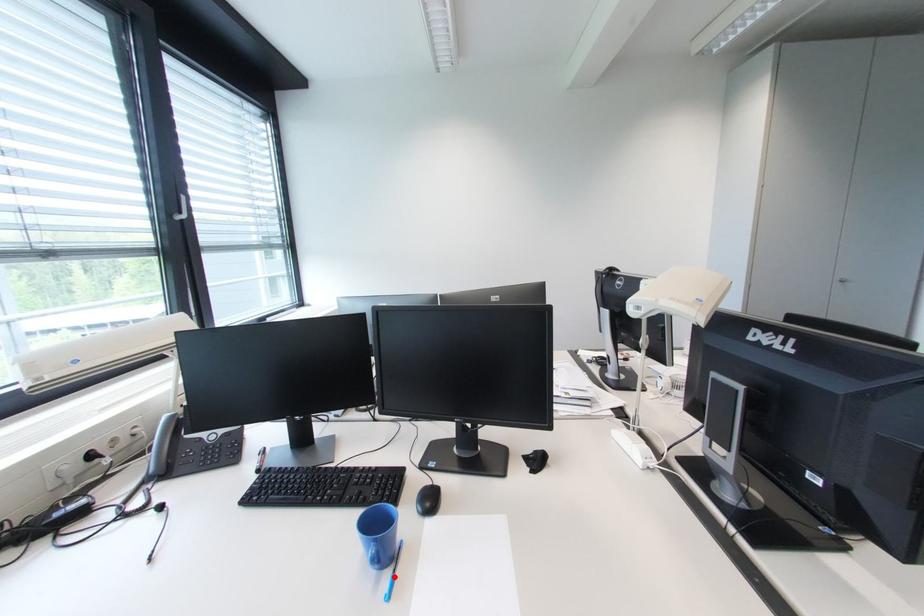
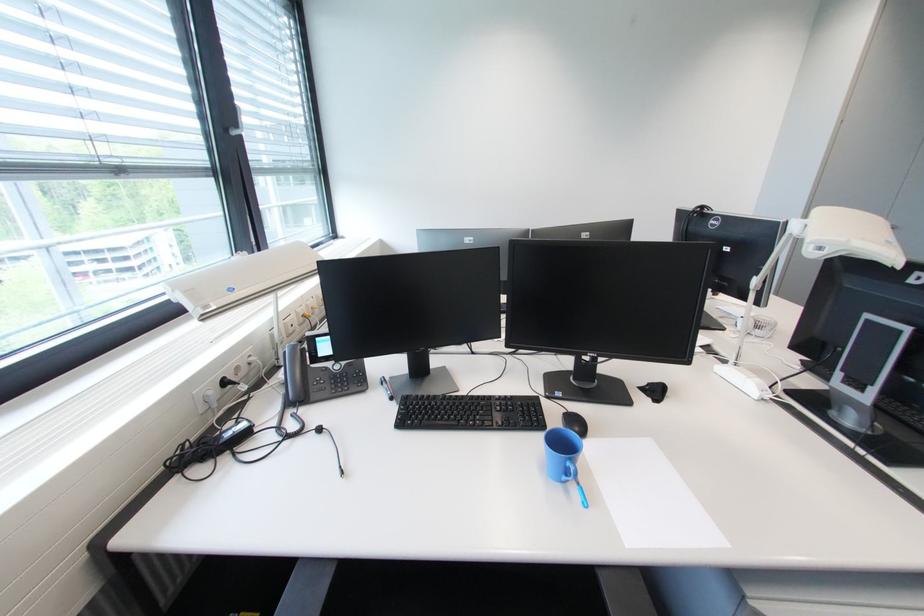
The point at the highlighted location is marked in the first image. Where is the corresponding point in the second image?

(579, 488)